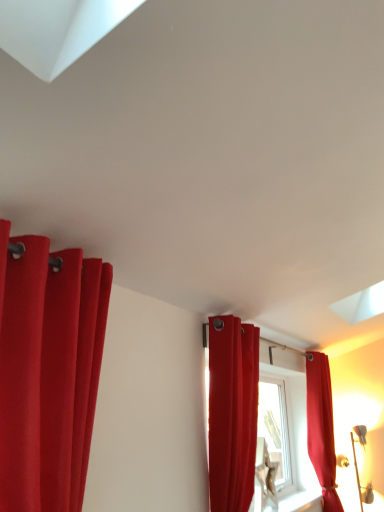
This screenshot has width=384, height=512. Describe the element at coordinates (321, 428) in the screenshot. I see `matte red curtain at right, the 1th curtain from the right` at that location.

Where is `matte red curtain at right, the 3th curtain viewed from the left`? Image resolution: width=384 pixels, height=512 pixels. matte red curtain at right, the 3th curtain viewed from the left is located at coordinates (321, 428).

Which is correct: matte red curtain at right, the 3th curtain viewed from the left, is inside matte red curtain at left, the 1th curtain from the left, or outside of it?

The correct answer is: outside.

Is matte red curtain at right, the 3th curtain viewed from the left, placed right next to matte red curtain at left, the 1th curtain from the left?

No, matte red curtain at right, the 3th curtain viewed from the left, is not with matte red curtain at left, the 1th curtain from the left.

In the image, is matte red curtain at right, placed as the 3th curtain when sorted from front to back, positioned in front of or behind matte red curtain at left, the 1th curtain from the left?

matte red curtain at right, placed as the 3th curtain when sorted from front to back, is positioned farther from the viewer than matte red curtain at left, the 1th curtain from the left.

Looking at this image, which of these two, matte red curtain at right, placed as the 3th curtain when sorted from front to back, or matte red curtain at left, arranged as the 3th curtain when viewed from the right, stands shorter?

matte red curtain at left, arranged as the 3th curtain when viewed from the right.

From a real-world perspective, is matte red curtain at left, the 1th curtain from the left, physically below matte red curtain at center, which is the second curtain in right-to-left order?

Actually, matte red curtain at left, the 1th curtain from the left, is physically above matte red curtain at center, which is the second curtain in right-to-left order, in the real world.

Can you tell me how much matte red curtain at left, which is the 1th curtain in front-to-back order, and matte red curtain at center, which is the second curtain in right-to-left order, differ in facing direction?

matte red curtain at left, which is the 1th curtain in front-to-back order, and matte red curtain at center, which is the second curtain in right-to-left order, are facing 0.000707 degrees away from each other.

Looking at this image, does matte red curtain at left, the 1th curtain from the left, turn towards matte red curtain at center, which ranks as the 2th curtain in front-to-back order?

No, matte red curtain at left, the 1th curtain from the left, does not turn towards matte red curtain at center, which ranks as the 2th curtain in front-to-back order.

Which object is further away from the camera, matte red curtain at left, which ranks as the third curtain in back-to-front order, or matte red curtain at center, which is counted as the 2th curtain, starting from the left?

matte red curtain at center, which is counted as the 2th curtain, starting from the left, is further away from the camera.

Which of these two, matte red curtain at right, the 1th curtain when ordered from back to front, or matte red curtain at center, which is counted as the 2th curtain, starting from the left, is wider?

With larger width is matte red curtain at right, the 1th curtain when ordered from back to front.

Is matte red curtain at right, the 3th curtain viewed from the left, far from matte red curtain at center, which is counted as the 2th curtain, starting from the left?

Yes, matte red curtain at right, the 3th curtain viewed from the left, and matte red curtain at center, which is counted as the 2th curtain, starting from the left, are located far from each other.

In the scene shown: In terms of size, does matte red curtain at right, the 1th curtain when ordered from back to front, appear bigger or smaller than matte red curtain at center, which ranks as the second curtain in back-to-front order?

matte red curtain at right, the 1th curtain when ordered from back to front, is bigger than matte red curtain at center, which ranks as the second curtain in back-to-front order.

From a real-world perspective, is matte red curtain at center, which ranks as the 2th curtain in front-to-back order, over matte red curtain at left, the 1th curtain from the left?

No, from a real-world perspective, matte red curtain at center, which ranks as the 2th curtain in front-to-back order, is not above matte red curtain at left, the 1th curtain from the left.

Considering the sizes of matte red curtain at center, which is the second curtain in right-to-left order, and matte red curtain at left, which ranks as the third curtain in back-to-front order, in the image, is matte red curtain at center, which is the second curtain in right-to-left order, bigger or smaller than matte red curtain at left, which ranks as the third curtain in back-to-front order,?

Considering their sizes, matte red curtain at center, which is the second curtain in right-to-left order, takes up more space than matte red curtain at left, which ranks as the third curtain in back-to-front order.

Is matte red curtain at center, which ranks as the 2th curtain in front-to-back order, directly adjacent to matte red curtain at left, the 1th curtain from the left?

No, matte red curtain at center, which ranks as the 2th curtain in front-to-back order, is not making contact with matte red curtain at left, the 1th curtain from the left.

Does matte red curtain at center, which ranks as the second curtain in back-to-front order, come behind matte red curtain at left, the 1th curtain from the left?

Yes, matte red curtain at center, which ranks as the second curtain in back-to-front order, is further from the camera.

Is matte red curtain at center, which is the second curtain in right-to-left order, smaller than matte red curtain at right, the 3th curtain viewed from the left?

Yes.

Locate an element on the screen. curtain below the matte red curtain at center, which is the second curtain in right-to-left order (from a real-world perspective) is located at coordinates (321, 428).

Is matte red curtain at center, which is counted as the 2th curtain, starting from the left, positioned before matte red curtain at right, the 1th curtain when ordered from back to front?

Yes, matte red curtain at center, which is counted as the 2th curtain, starting from the left, is closer to the viewer.

Image resolution: width=384 pixels, height=512 pixels. Find the location of `the 2nd curtain positioned below the matte red curtain at left, which is the 1th curtain in front-to-back order (from a real-world perspective)`. the 2nd curtain positioned below the matte red curtain at left, which is the 1th curtain in front-to-back order (from a real-world perspective) is located at coordinates (321, 428).

Is matte red curtain at right, the 1th curtain from the right, at the back of matte red curtain at left, which ranks as the third curtain in back-to-front order?

That's not correct — matte red curtain at left, which ranks as the third curtain in back-to-front order, is not looking away from matte red curtain at right, the 1th curtain from the right.

Which of these two, matte red curtain at left, arranged as the 3th curtain when viewed from the right, or matte red curtain at right, placed as the 3th curtain when sorted from front to back, is smaller?

matte red curtain at left, arranged as the 3th curtain when viewed from the right, is smaller.

Consider the image. Is matte red curtain at left, which is the 1th curtain in front-to-back order, at the right side of matte red curtain at right, the 1th curtain when ordered from back to front?

No.

Starting from the matte red curtain at right, the 1th curtain from the right, which curtain is the 2nd one in front? Please provide its 2D coordinates.

[(48, 371)]

Where is `the 1st curtain behind the matte red curtain at left, which is the 1th curtain in front-to-back order, counting from the anchor's position`? The height and width of the screenshot is (512, 384). the 1st curtain behind the matte red curtain at left, which is the 1th curtain in front-to-back order, counting from the anchor's position is located at coordinates (232, 412).

From the image, which object appears to be farther from matte red curtain at left, the 1th curtain from the left, matte red curtain at right, the 1th curtain from the right, or matte red curtain at center, which is counted as the 2th curtain, starting from the left?

The object further to matte red curtain at left, the 1th curtain from the left, is matte red curtain at right, the 1th curtain from the right.

Estimate the real-world distances between objects in this image. Which object is closer to matte red curtain at center, which is counted as the 2th curtain, starting from the left, matte red curtain at left, the 1th curtain from the left, or matte red curtain at right, the 1th curtain when ordered from back to front?

matte red curtain at left, the 1th curtain from the left, is closer to matte red curtain at center, which is counted as the 2th curtain, starting from the left.

Which object lies further to the anchor point matte red curtain at right, the 3th curtain viewed from the left, matte red curtain at center, which ranks as the second curtain in back-to-front order, or matte red curtain at left, which ranks as the third curtain in back-to-front order?

Among the two, matte red curtain at left, which ranks as the third curtain in back-to-front order, is located further to matte red curtain at right, the 3th curtain viewed from the left.

When comparing their distances from matte red curtain at right, the 1th curtain from the right, does matte red curtain at left, which is the 1th curtain in front-to-back order, or matte red curtain at center, which ranks as the second curtain in back-to-front order, seem closer?

matte red curtain at center, which ranks as the second curtain in back-to-front order, is positioned closer to the anchor matte red curtain at right, the 1th curtain from the right.

From the image, which object appears to be farther from matte red curtain at left, which is the 1th curtain in front-to-back order, matte red curtain at center, which is the second curtain in right-to-left order, or matte red curtain at right, the 3th curtain viewed from the left?

matte red curtain at right, the 3th curtain viewed from the left, is further to matte red curtain at left, which is the 1th curtain in front-to-back order.

Considering their positions, is matte red curtain at right, the 1th curtain when ordered from back to front, positioned further to matte red curtain at center, which is counted as the 2th curtain, starting from the left, than matte red curtain at left, which is the 1th curtain in front-to-back order?

matte red curtain at right, the 1th curtain when ordered from back to front, is positioned further to the anchor matte red curtain at center, which is counted as the 2th curtain, starting from the left.

Image resolution: width=384 pixels, height=512 pixels. I want to click on curtain located between matte red curtain at left, the 1th curtain from the left, and matte red curtain at right, the 3th curtain viewed from the left, in the depth direction, so click(x=232, y=412).